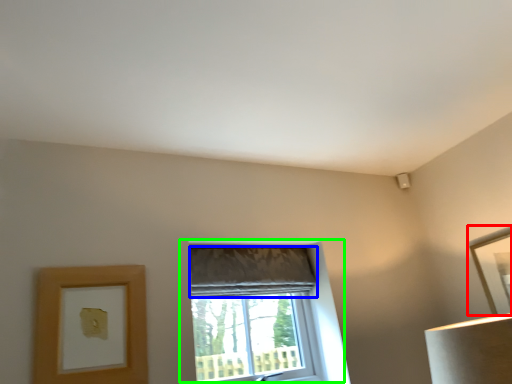
Question: Based on their relative distances, which object is nearer to picture frame (highlighted by a red box)? Choose from curtain (highlighted by a blue box) and window (highlighted by a green box).

Choices:
 (A) curtain
 (B) window

Answer: (B)